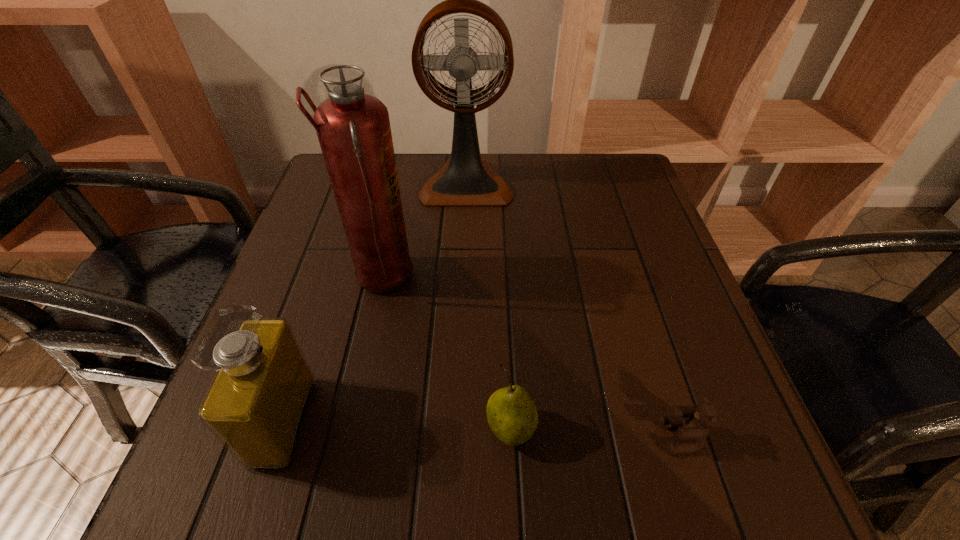
Locate an element on the screen. The image size is (960, 540). free space located on the right of the second shortest object is located at coordinates (746, 429).

I want to click on free space located 0.240m on the face of the rightmost object, so click(501, 437).

Locate an element on the screen. Image resolution: width=960 pixels, height=540 pixels. free space located on the face of the rightmost object is located at coordinates (461, 437).

Image resolution: width=960 pixels, height=540 pixels. I want to click on blank area located 0.140m on the face of the rightmost object, so click(568, 437).

Where is `object located in the far edge section of the desktop`? object located in the far edge section of the desktop is located at coordinates (465, 180).

Identify the location of perfume located in the near edge section of the desktop. (256, 404).

You are a GUI agent. You are given a task and a screenshot of the screen. Output one action in this format:
    pyautogui.click(x=<x>, y=<y>)
    Task: Click on the pear present at the near edge
    The image size is (960, 540).
    Given the screenshot: What is the action you would take?
    pyautogui.click(x=512, y=415)

Find the location of a particular element. Image resolution: width=960 pixels, height=540 pixels. teddy bear positioned at the near edge is located at coordinates (695, 429).

Find the location of a particular element. fire extinguisher located in the left edge section of the desktop is located at coordinates (353, 128).

Where is `perfume that is positioned at the left edge`? The height and width of the screenshot is (540, 960). perfume that is positioned at the left edge is located at coordinates (256, 404).